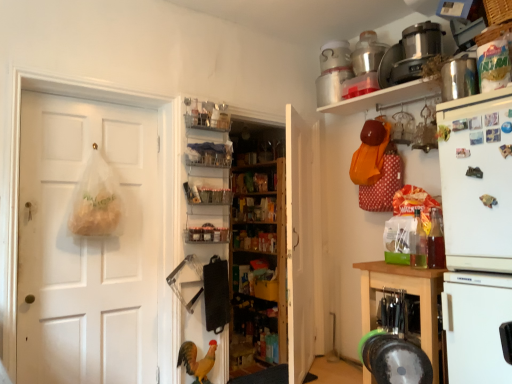
Question: From the image's perspective, is metallic silver magnet at upper right, the 2th magnet positioned from the top, located above or below translucent plastic coffee cup at right?

Choices:
 (A) below
 (B) above

Answer: (B)

Question: Is point (484, 203) positioned closer to the camera than point (436, 261)?

Choices:
 (A) closer
 (B) farther

Answer: (A)

Question: Which object is positioned farthest from the yellow matte chicken at lower center?

Choices:
 (A) clear plastic shelf at center, the 3th shelf positioned from the left
 (B) translucent plastic coffee cup at right
 (C) clear plastic shelves at center, acting as the 4th shelf starting from the right
 (D) metallic silver magnet at upper right, the 2th magnet positioned from the top
 (E) metallic silver food processor at upper right, positioned as the 3th appliance in bottom-to-top order

Answer: (E)

Question: Estimate the real-world distances between objects in this image. Which object is farther from the wooden shelves at center, which is counted as the 2th bookshelf, starting from the back?

Choices:
 (A) white matte refrigerator at right
 (B) metallic stainless steel container at upper right, which is counted as the 2th appliance, starting from the front
 (C) metallic silver food processor at upper right, acting as the third appliance starting from the front
 (D) translucent plastic coffee cup at right
 (E) white matte door at center, arranged as the second door when viewed from the left

Answer: (B)